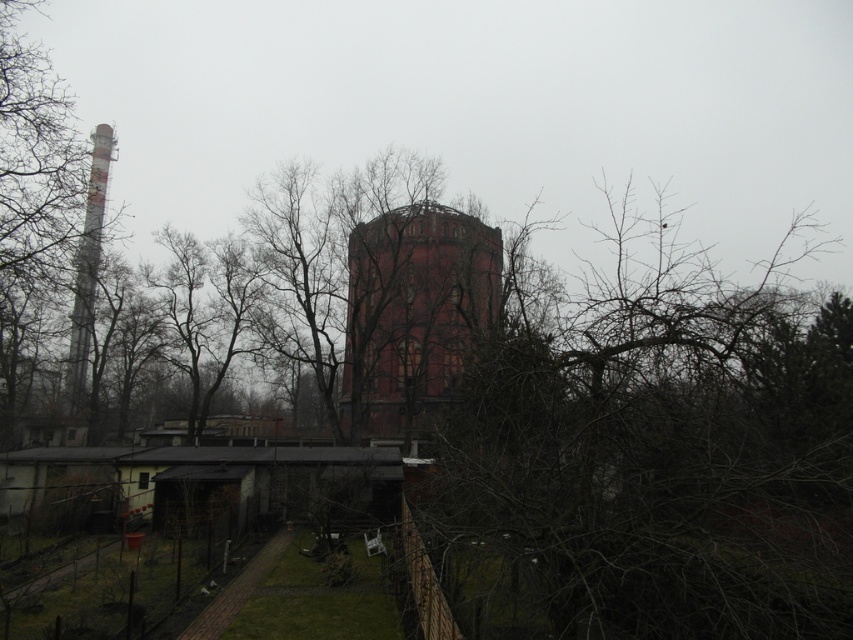
You are standing in the garden area and want to take a photo of the rustic brick tower at center without the bare branches at center blocking the view. Which direction should you move to achieve this?

Move to the left of the rustic brick tower at center so the bare branches at center are no longer in front of it.